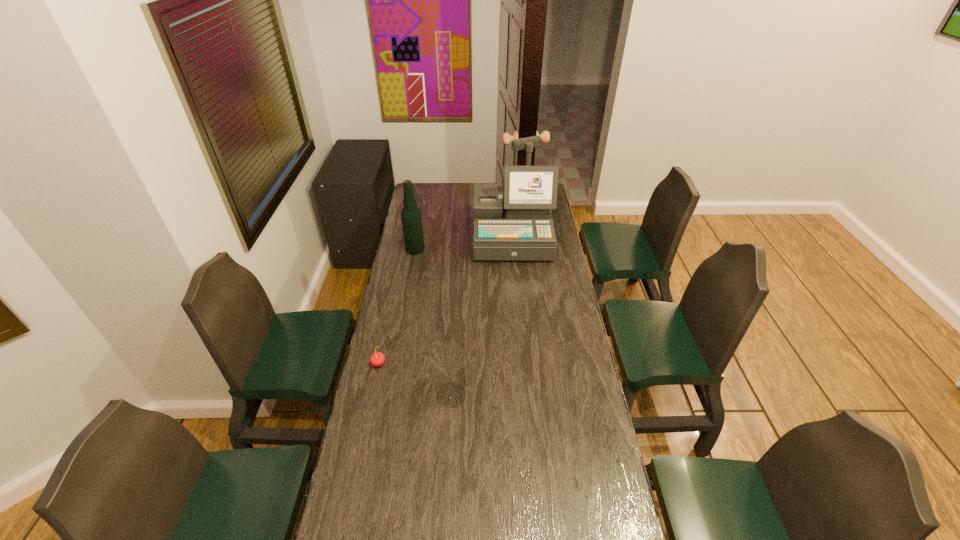
Image resolution: width=960 pixels, height=540 pixels. I want to click on free point located on the front of the shortest object, so click(x=363, y=436).

You are a GUI agent. You are given a task and a screenshot of the screen. Output one action in this format:
    pyautogui.click(x=<x>, y=<y>)
    Task: Click on the alcohol situated at the left edge
    Image resolution: width=960 pixels, height=540 pixels.
    Given the screenshot: What is the action you would take?
    pyautogui.click(x=411, y=218)

Where is `cherry that is positioned at the left edge`? This screenshot has height=540, width=960. cherry that is positioned at the left edge is located at coordinates (377, 359).

I want to click on object that is at the right edge, so click(518, 226).

This screenshot has width=960, height=540. Identify the location of vacant space at the far edge. (457, 197).

Where is `blank space at the left edge of the desktop`? Image resolution: width=960 pixels, height=540 pixels. blank space at the left edge of the desktop is located at coordinates (424, 224).

I want to click on free space at the right edge of the desktop, so click(537, 303).

Locate an element on the screen. This screenshot has height=540, width=960. vacant point located between the alcohol and the rightmost object is located at coordinates (464, 244).

Identify the location of free space between the alcohol and the rightmost object. The image size is (960, 540). (464, 244).

This screenshot has width=960, height=540. Find the location of `free point between the second tallest object and the rightmost object`. free point between the second tallest object and the rightmost object is located at coordinates (464, 244).